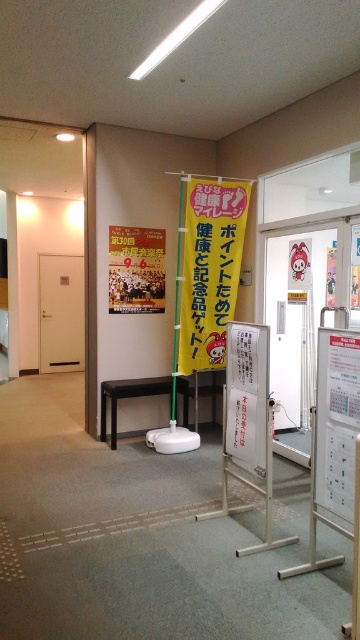
Question: Does yellow paper poster at center appear on the right side of black glossy stool at center?

Choices:
 (A) no
 (B) yes

Answer: (A)

Question: Which point is farther from the camera taking this photo?

Choices:
 (A) (261, 342)
 (B) (186, 269)

Answer: (B)

Question: Is yellow fabric banner at center smaller than white paperboard at center?

Choices:
 (A) no
 (B) yes

Answer: (A)

Question: Which point is closer to the camera?

Choices:
 (A) yellow fabric banner at center
 (B) black glossy stool at center
 (C) white paper at center

Answer: (C)

Question: Which object is positioned farthest from the yellow fabric banner at center?

Choices:
 (A) yellow paper poster at center
 (B) black glossy stool at center

Answer: (B)

Question: Can you confirm if white paperboard at center is bigger than white paper at center?

Choices:
 (A) yes
 (B) no

Answer: (A)